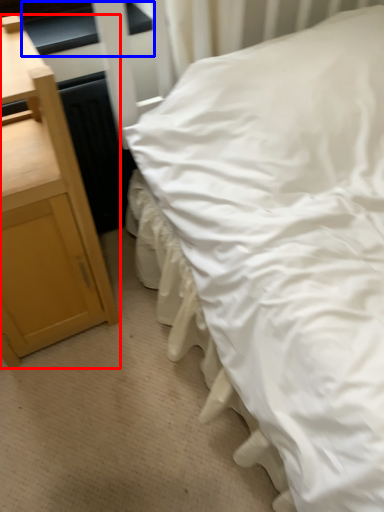
Question: Which object appears farthest to the camera in this image, nightstand (highlighted by a red box) or window sill (highlighted by a blue box)?

Choices:
 (A) nightstand
 (B) window sill

Answer: (B)